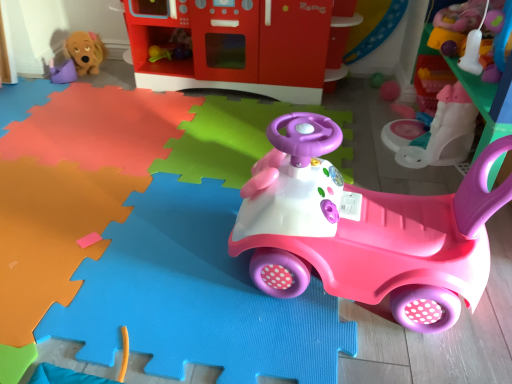
Where is `free space in front of matte purple toy at upper left, which is the sixth toy in right-to-left order`? Image resolution: width=512 pixels, height=384 pixels. free space in front of matte purple toy at upper left, which is the sixth toy in right-to-left order is located at coordinates (48, 94).